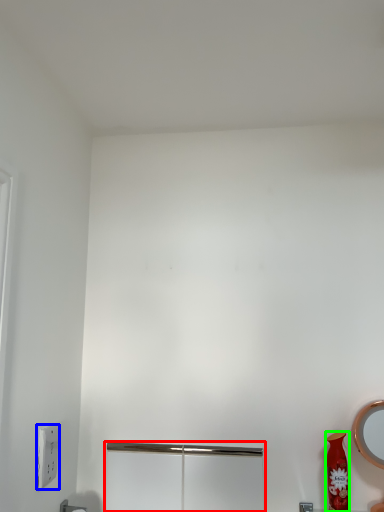
Question: Which object is positioned farthest from screen door (highlighted by a red box)? Select from light switch (highlighted by a blue box) and vase (highlighted by a green box).

Choices:
 (A) light switch
 (B) vase

Answer: (B)